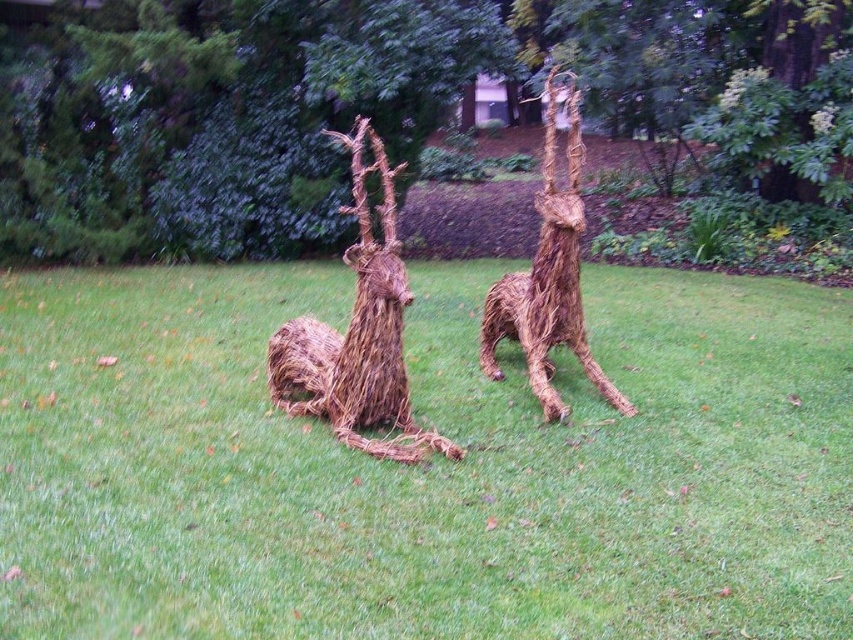
Question: Does green grass at center have a greater width compared to braided straw giraffe at center?

Choices:
 (A) yes
 (B) no

Answer: (A)

Question: Which point is farther to the camera?

Choices:
 (A) (631, 410)
 (B) (437, 413)

Answer: (A)

Question: From the image, what is the correct spatial relationship of green grass at center in relation to braided straw giraffe at center?

Choices:
 (A) right
 (B) left

Answer: (B)

Question: Can you confirm if green grass at center is smaller than braided straw giraffe at center?

Choices:
 (A) yes
 (B) no

Answer: (A)